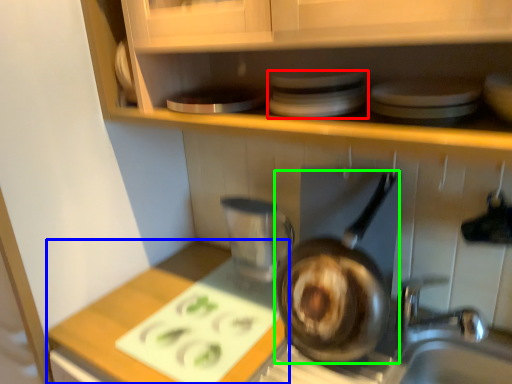
Question: Which object is positioned farthest from appliance (highlighted by a red box)? Select from counter top (highlighted by a blue box) and frying pan (highlighted by a green box).

Choices:
 (A) counter top
 (B) frying pan

Answer: (A)